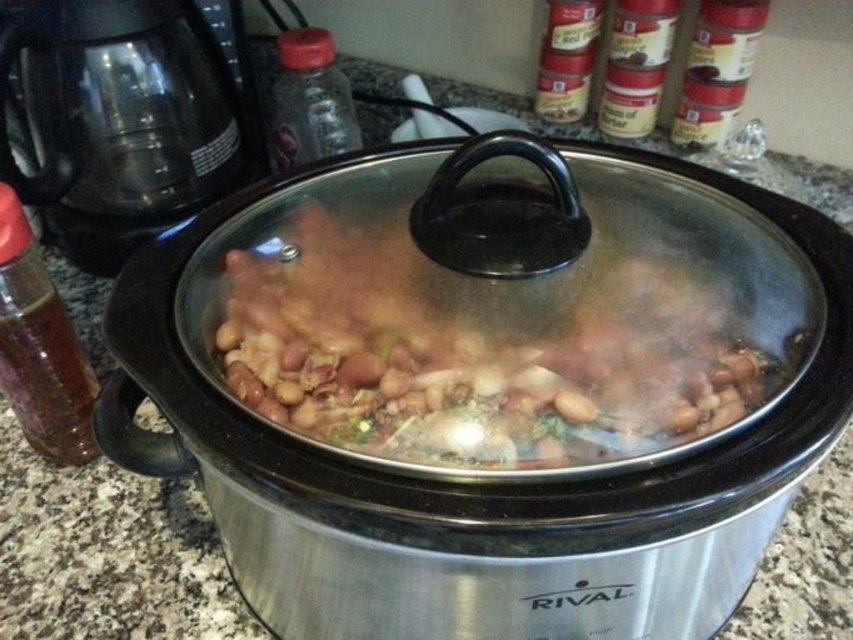
Question: Is stainless steel crock pot at center bigger than translucent plastic bottle at upper center?

Choices:
 (A) no
 (B) yes

Answer: (B)

Question: Is stainless steel crock pot at center bigger than brown matte beans at center?

Choices:
 (A) yes
 (B) no

Answer: (A)

Question: Which point is farther to the camera?

Choices:
 (A) (312, 132)
 (B) (521, 440)

Answer: (A)

Question: Does brown matte beans at center appear over translucent glass bottle at left?

Choices:
 (A) no
 (B) yes

Answer: (B)

Question: Which point is farther to the camera?

Choices:
 (A) (573, 339)
 (B) (686, 556)
 (C) (64, 461)

Answer: (C)

Question: Which object is the farthest from the translucent plastic bottle at upper center?

Choices:
 (A) stainless steel crock pot at center
 (B) translucent glass bottle at left

Answer: (A)